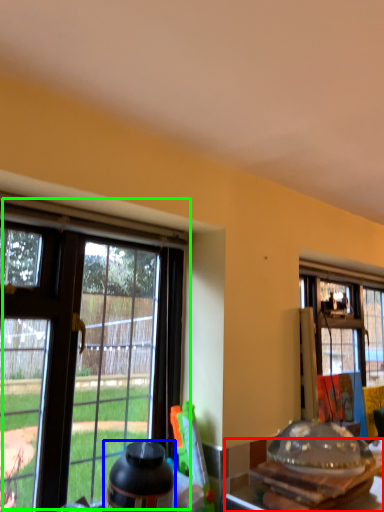
Question: Considering the real-world distances, which object is farthest from kitchen & dining room table (highlighted by a red box)? bottle (highlighted by a blue box) or window (highlighted by a green box)?

Choices:
 (A) bottle
 (B) window

Answer: (B)